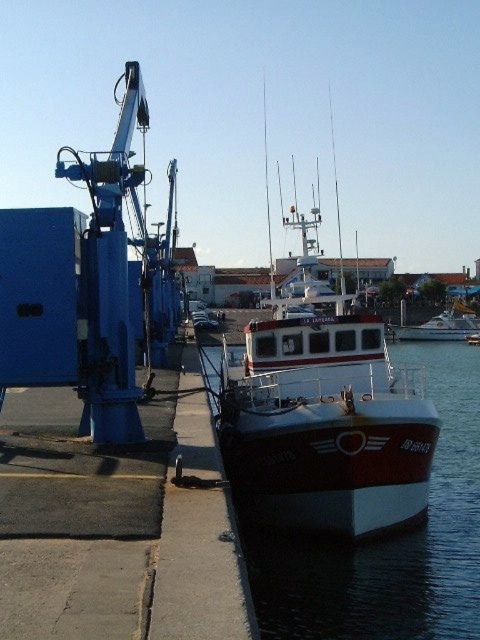
How far apart are white glossy water at center and white glossy boat at center?

They are 78.18 feet apart.

Is white glossy water at center to the left of white glossy boat at center from the viewer's perspective?

Yes, white glossy water at center is to the left of white glossy boat at center.

Image resolution: width=480 pixels, height=640 pixels. Find the location of `white glossy water at center`. white glossy water at center is located at coordinates (389, 540).

Image resolution: width=480 pixels, height=640 pixels. Find the location of `white glossy water at center`. white glossy water at center is located at coordinates (389, 540).